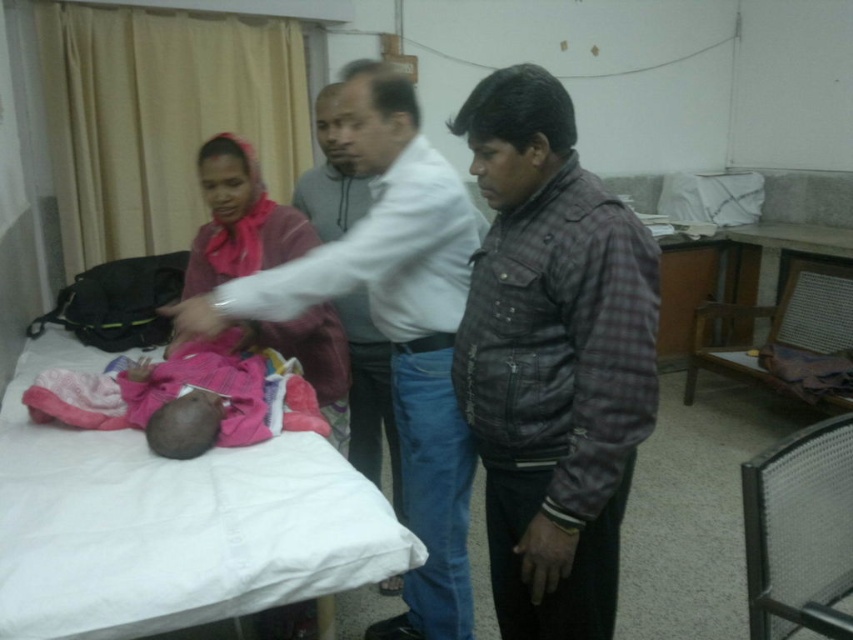
Question: Is pink fabric baby at center closer to camera compared to plaid leather jacket at right?

Choices:
 (A) yes
 (B) no

Answer: (A)

Question: Estimate the real-world distances between objects in this image. Which object is closer to the white fabric bed at center?

Choices:
 (A) pink fabric baby at center
 (B) plaid leather jacket at right

Answer: (B)

Question: Does pink fabric baby at center lie behind white fabric bed at center?

Choices:
 (A) yes
 (B) no

Answer: (A)

Question: Which point is closer to the camera?

Choices:
 (A) plaid leather jacket at right
 (B) pink fabric headscarf at upper left
 (C) white fabric bed at center

Answer: (C)

Question: Which point is farther from the camera taking this photo?

Choices:
 (A) (302, 209)
 (B) (206, 307)
 (C) (268, 218)

Answer: (A)

Question: Does plaid leather jacket at right appear under white fabric bed at center?

Choices:
 (A) yes
 (B) no

Answer: (B)